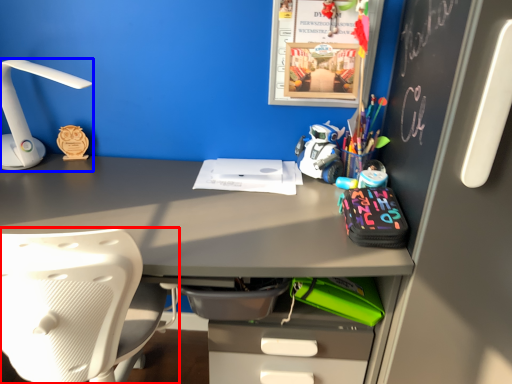
Question: Which object appears closest to the camera in this image, chair (highlighted by a red box) or lamp (highlighted by a blue box)?

Choices:
 (A) chair
 (B) lamp

Answer: (A)